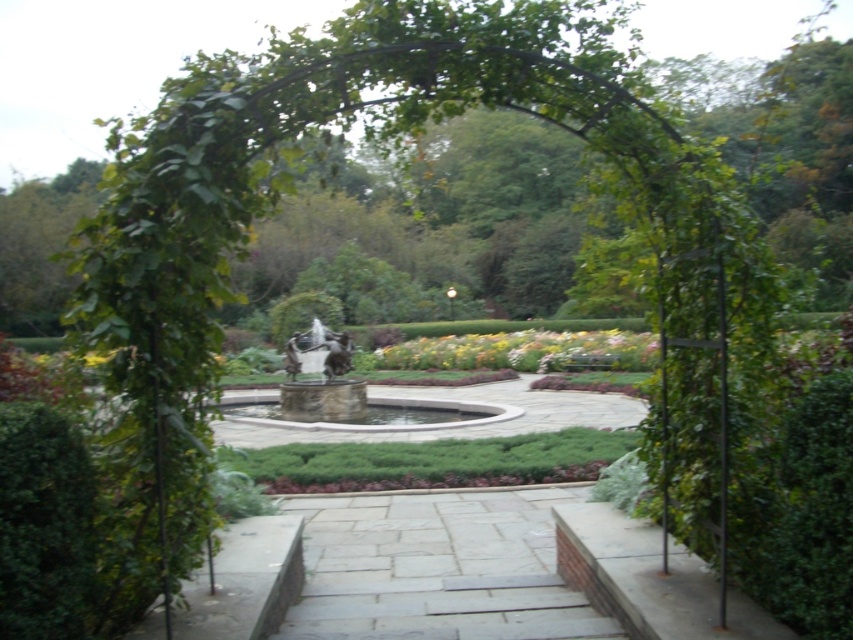
Question: Does gray stone path at center have a lesser width compared to polished bronze statue at center?

Choices:
 (A) no
 (B) yes

Answer: (B)

Question: Which point is farther from the camera taking this photo?

Choices:
 (A) (438, 612)
 (B) (289, 355)
 (C) (300, 404)
 (D) (453, 352)

Answer: (D)

Question: Does yellow matte flowers at center appear on the right side of polished bronze statue at center?

Choices:
 (A) yes
 (B) no

Answer: (A)

Question: Which of the following is the closest to the observer?

Choices:
 (A) (515, 524)
 (B) (310, 364)
 (C) (306, 412)

Answer: (A)

Question: Can you confirm if gray stone path at center is positioned above white marble fountain at center?

Choices:
 (A) no
 (B) yes

Answer: (A)

Question: Estimate the real-world distances between objects in this image. Which object is farther from the polished bronze statue at center?

Choices:
 (A) white marble fountain at center
 (B) yellow matte flowers at center

Answer: (A)